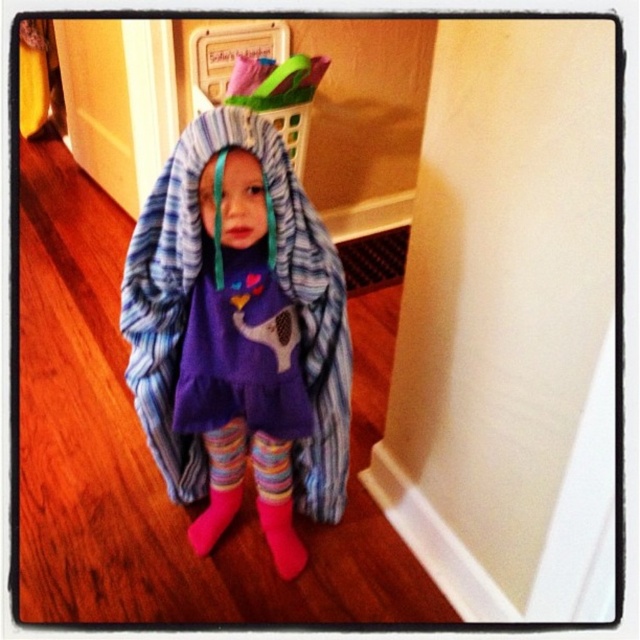
Question: Can you confirm if striped fleece blanket at center is positioned to the left of pink fuzzy socks at lower center?

Choices:
 (A) no
 (B) yes

Answer: (B)

Question: Which of the following is the closest to the observer?

Choices:
 (A) (275, 520)
 (B) (164, 385)
 (C) (211, 502)

Answer: (B)

Question: Which of the following is the closest to the observer?

Choices:
 (A) (298, 545)
 (B) (211, 504)

Answer: (A)

Question: Can you confirm if striped fleece blanket at center is positioned to the left of pink fuzzy sock at lower center?

Choices:
 (A) no
 (B) yes

Answer: (A)

Question: Considering the relative positions of striped fleece blanket at center and pink fuzzy socks at lower center in the image provided, where is striped fleece blanket at center located with respect to pink fuzzy socks at lower center?

Choices:
 (A) right
 (B) left

Answer: (B)

Question: Among these objects, which one is nearest to the camera?

Choices:
 (A) pink fuzzy sock at lower center
 (B) pink fuzzy socks at lower center

Answer: (B)